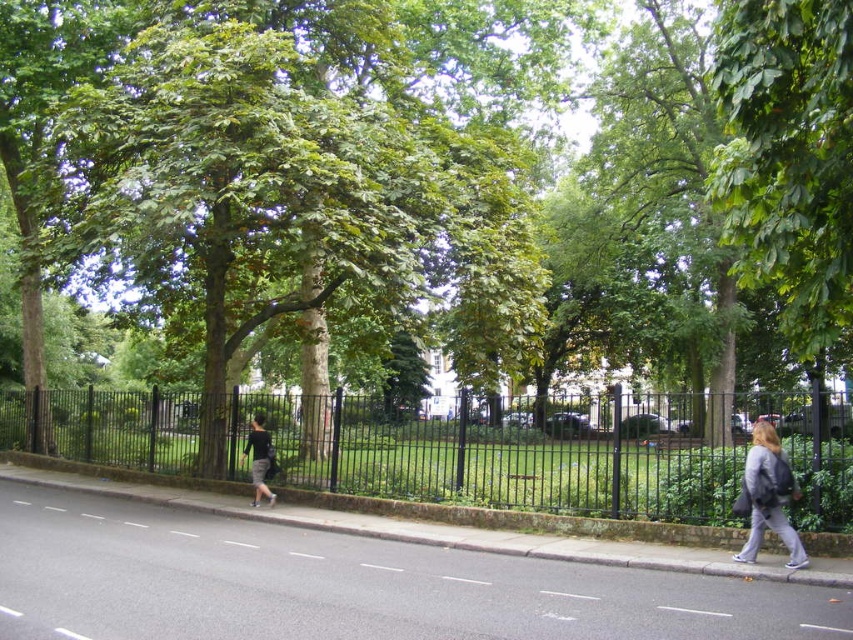
You are a delivery person trying to see if you can spot the gray fabric jacket at lower right from outside the park through the black metal fence at center. Based on their heights, is the jacket visible over the fence?

The black metal fence at center has a greater height compared to gray fabric jacket at lower right, so the jacket would not be visible over the fence.

You are standing in the park and want to take a photo of both point [637,438] and point [254,444] in the scene. Which point should you focus on first to ensure both are in sharp focus?

You should focus on point [637,438] first because it is closer to the camera than point [254,444]. This ensures both points will be in focus as the closer point determines the focal plane.

You are standing on the paved road with white lane markings and want to walk towards the gray fabric jacket at lower right. Which direction should you turn to avoid walking past the green leafy tree at center?

Since the green leafy tree at center is to the left of the gray fabric jacket at lower right, you should turn to the right to avoid walking past the green leafy tree at center and head towards the gray fabric jacket at lower right.